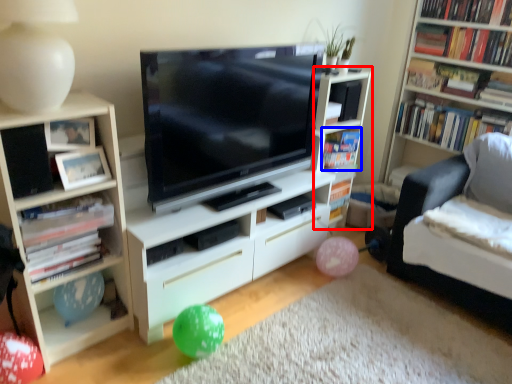
Question: Which object is further to the camera taking this photo, shelf (highlighted by a red box) or book (highlighted by a blue box)?

Choices:
 (A) shelf
 (B) book

Answer: (B)